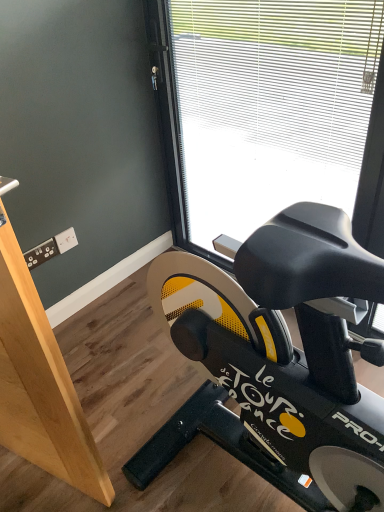
Question: Considering the relative positions of transparent glass window at center and light brown wood at left in the image provided, is transparent glass window at center to the left of light brown wood at left from the viewer's perspective?

Choices:
 (A) yes
 (B) no

Answer: (B)

Question: Is transparent glass window at center thinner than light brown wood at left?

Choices:
 (A) yes
 (B) no

Answer: (B)

Question: From a real-world perspective, does transparent glass window at center sit lower than light brown wood at left?

Choices:
 (A) yes
 (B) no

Answer: (A)

Question: Is transparent glass window at center turned away from light brown wood at left?

Choices:
 (A) no
 (B) yes

Answer: (A)

Question: Does transparent glass window at center appear on the right side of light brown wood at left?

Choices:
 (A) yes
 (B) no

Answer: (A)

Question: In the image, is transparent glass window at center positioned in front of or behind light brown wood at left?

Choices:
 (A) behind
 (B) front

Answer: (A)

Question: Based on their sizes in the image, would you say transparent glass window at center is bigger or smaller than light brown wood at left?

Choices:
 (A) small
 (B) big

Answer: (B)

Question: In the image, is transparent glass window at center on the left side or the right side of light brown wood at left?

Choices:
 (A) right
 (B) left

Answer: (A)

Question: From a real-world perspective, relative to light brown wood at left, is transparent glass window at center vertically above or below?

Choices:
 (A) below
 (B) above

Answer: (A)

Question: In terms of height, does black matte stationary bicycle at lower right look taller or shorter compared to light brown wood at left?

Choices:
 (A) tall
 (B) short

Answer: (B)

Question: Is point (240, 292) positioned closer to the camera than point (67, 468)?

Choices:
 (A) farther
 (B) closer

Answer: (B)

Question: From the image's perspective, relative to light brown wood at left, is black matte stationary bicycle at lower right above or below?

Choices:
 (A) below
 (B) above

Answer: (A)

Question: In terms of size, does black matte stationary bicycle at lower right appear bigger or smaller than light brown wood at left?

Choices:
 (A) big
 (B) small

Answer: (B)

Question: Is point [x=306, y=1] closer or farther from the camera than point [x=251, y=422]?

Choices:
 (A) closer
 (B) farther

Answer: (B)

Question: From a real-world perspective, is transparent glass window at center positioned above or below black matte stationary bicycle at lower right?

Choices:
 (A) above
 (B) below

Answer: (A)